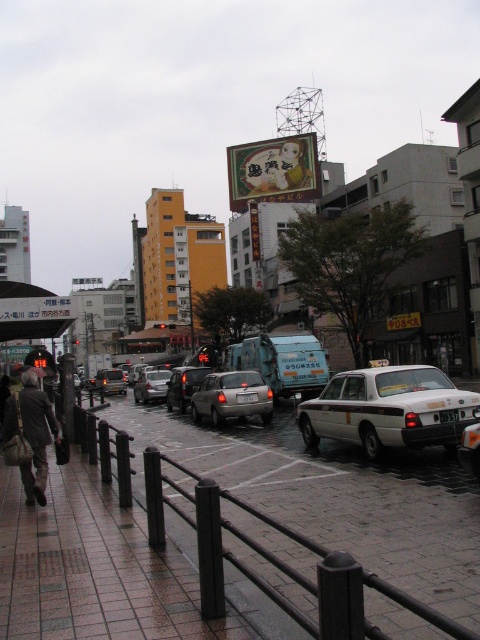
Who is lower down, brown leather jacket at lower left or shiny silver sedan at center?

shiny silver sedan at center is below.

Who is higher up, brown leather jacket at lower left or shiny silver sedan at center?

brown leather jacket at lower left is above.

Where is `brown leather jacket at lower left`? The image size is (480, 640). brown leather jacket at lower left is located at coordinates (32, 433).

What are the coordinates of `brown leather jacket at lower left` in the screenshot? It's located at (32, 433).

Who is more forward, (163, 369) or (105, 394)?

Point (105, 394) is more forward.

Can you confirm if silver metallic sedan at center is positioned below matte black sedan at center?

A: No.

Which is behind, point (158, 372) or point (101, 380)?

The point (101, 380) is more distant.

Image resolution: width=480 pixels, height=640 pixels. Identify the location of silver metallic sedan at center. (151, 385).

Which is behind, point (240, 342) or point (262, 420)?

The point (240, 342) is more distant.

Who is positioned more to the left, blue metallic garbage truck at center or satin silver sedan at center?

Positioned to the left is satin silver sedan at center.

Image resolution: width=480 pixels, height=640 pixels. What are the coordinates of `blue metallic garbage truck at center` in the screenshot? It's located at (283, 362).